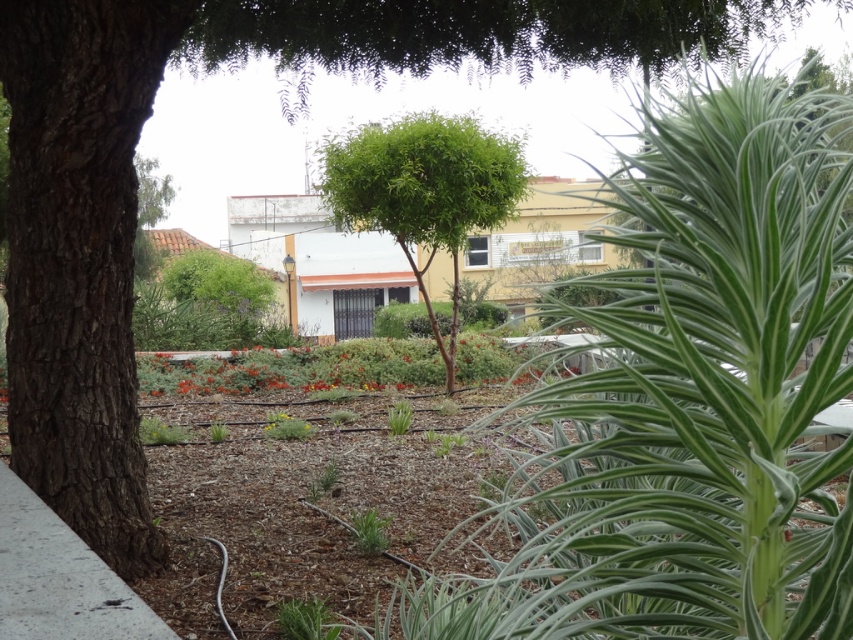
Question: Can you confirm if green leafy tree at center is thinner than gray concrete pavement at lower left?

Choices:
 (A) no
 (B) yes

Answer: (A)

Question: Which point appears farthest from the camera in this image?

Choices:
 (A) (30, 564)
 (B) (337, 195)

Answer: (B)

Question: Considering the relative positions of green leafy tree at center and gray concrete pavement at lower left in the image provided, where is green leafy tree at center located with respect to gray concrete pavement at lower left?

Choices:
 (A) left
 (B) right

Answer: (B)

Question: Can you confirm if green leafy tree at center is positioned to the right of gray concrete pavement at lower left?

Choices:
 (A) yes
 (B) no

Answer: (A)